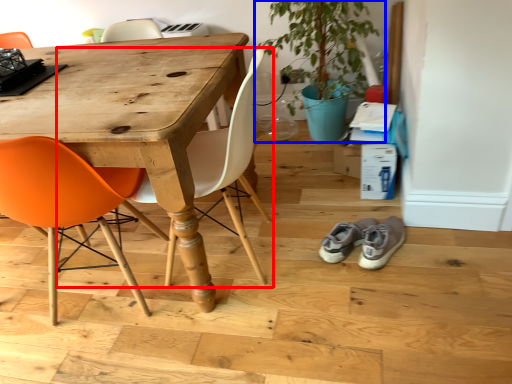
Question: Which object is closer to the camera taking this photo, chair (highlighted by a red box) or houseplant (highlighted by a blue box)?

Choices:
 (A) chair
 (B) houseplant

Answer: (A)